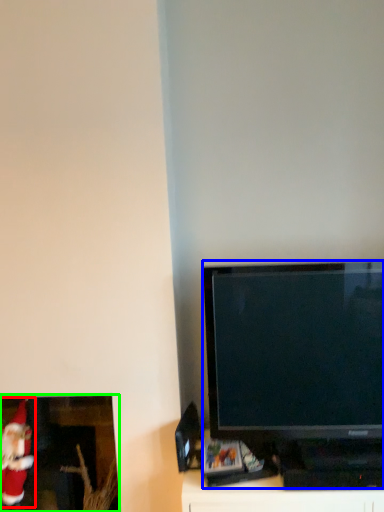
Question: Estimate the real-world distances between objects in this image. Which object is closer to santa claus (highlighted by a red box), television (highlighted by a blue box) or picture frame (highlighted by a green box)?

Choices:
 (A) television
 (B) picture frame

Answer: (B)